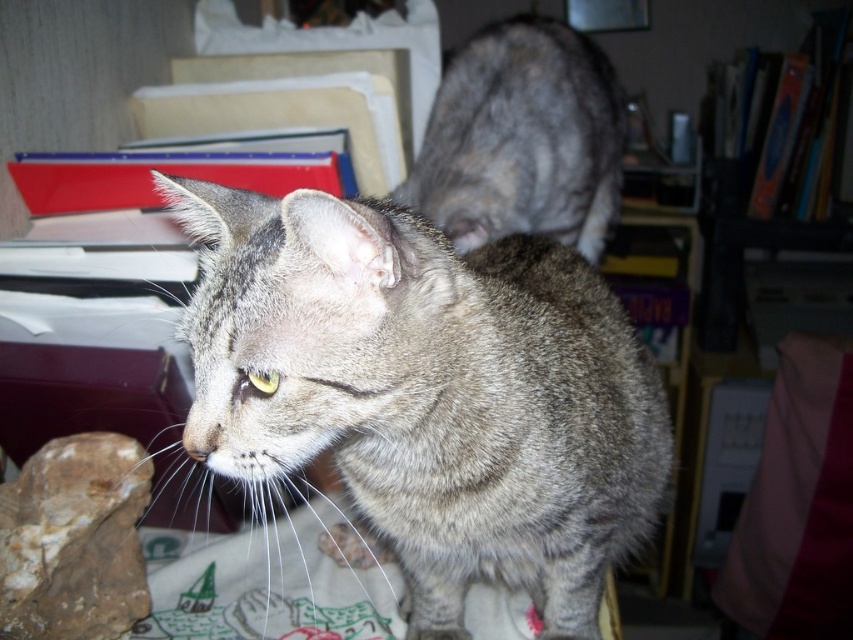
Which is behind, point (614, 460) or point (585, 189)?

The point (585, 189) is more distant.

How much distance is there between gray tabby cat at center and gray tabby cat at upper center?

gray tabby cat at center is 27.59 inches from gray tabby cat at upper center.

At what (x,y) coordinates should I click in order to perform the action: click on gray tabby cat at center. Please return your answer as a coordinate pair (x, y). Image resolution: width=853 pixels, height=640 pixels. Looking at the image, I should click on (427, 392).

What are the coordinates of `gray tabby cat at center` in the screenshot? It's located at (427, 392).

Does gray tabby cat at upper center have a lesser height compared to brown rough rock at lower left?

No, gray tabby cat at upper center is not shorter than brown rough rock at lower left.

This screenshot has width=853, height=640. Find the location of `gray tabby cat at upper center`. gray tabby cat at upper center is located at coordinates (521, 138).

Is point (558, 632) positioned behind point (44, 554)?

Yes, it is behind point (44, 554).

Between gray tabby cat at center and brown rough rock at lower left, which one has less height?

With less height is brown rough rock at lower left.

Find the location of `gray tabby cat at center`. gray tabby cat at center is located at coordinates (427, 392).